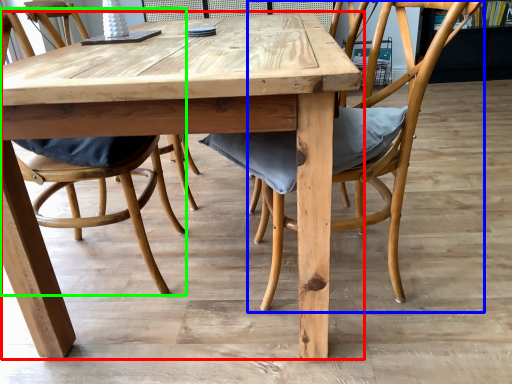
Question: Which object is the farthest from kitchen & dining room table (highlighted by a red box)? Choose among these: chair (highlighted by a blue box) or chair (highlighted by a green box).

Choices:
 (A) chair
 (B) chair

Answer: (B)